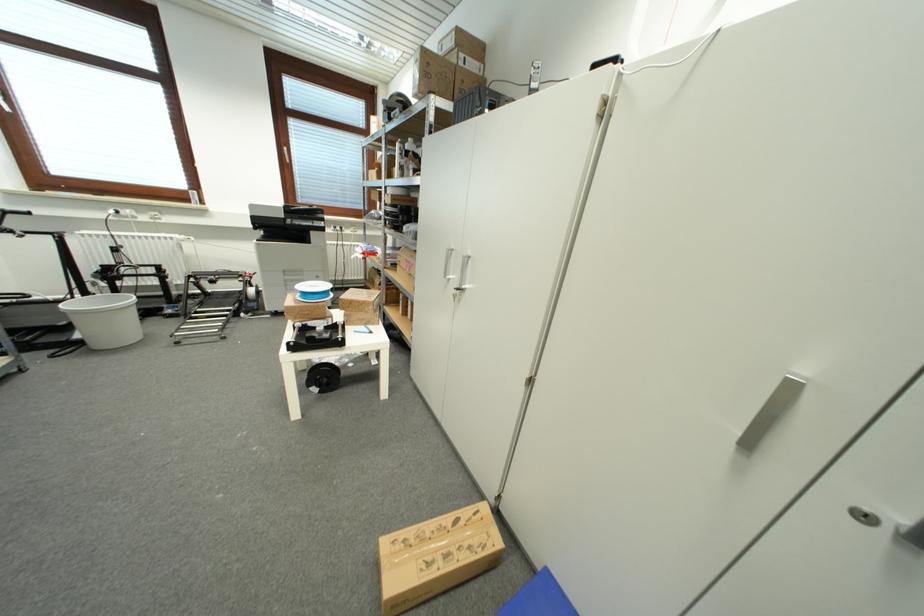
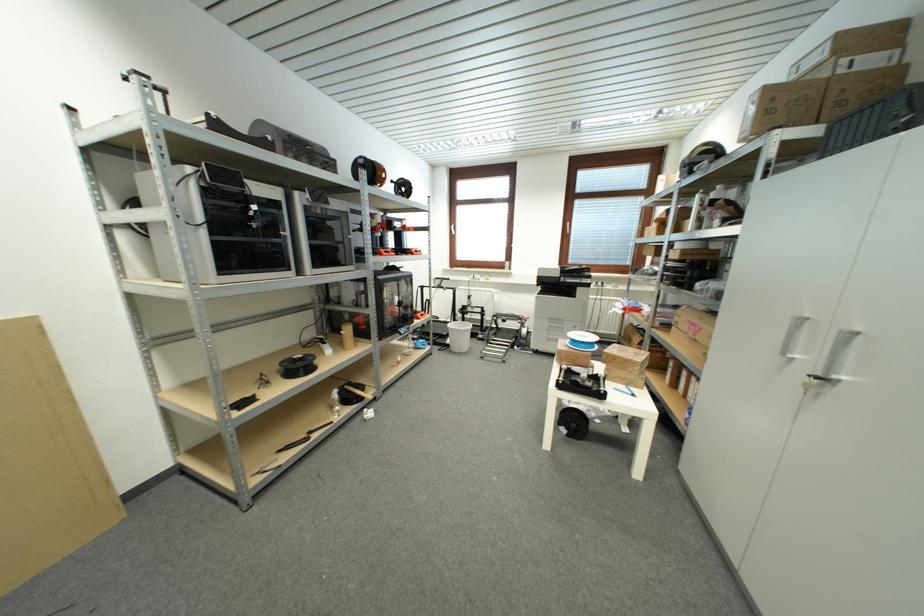
In the second image, find the point that corresponds to point (312, 338) in the first image.

(578, 381)